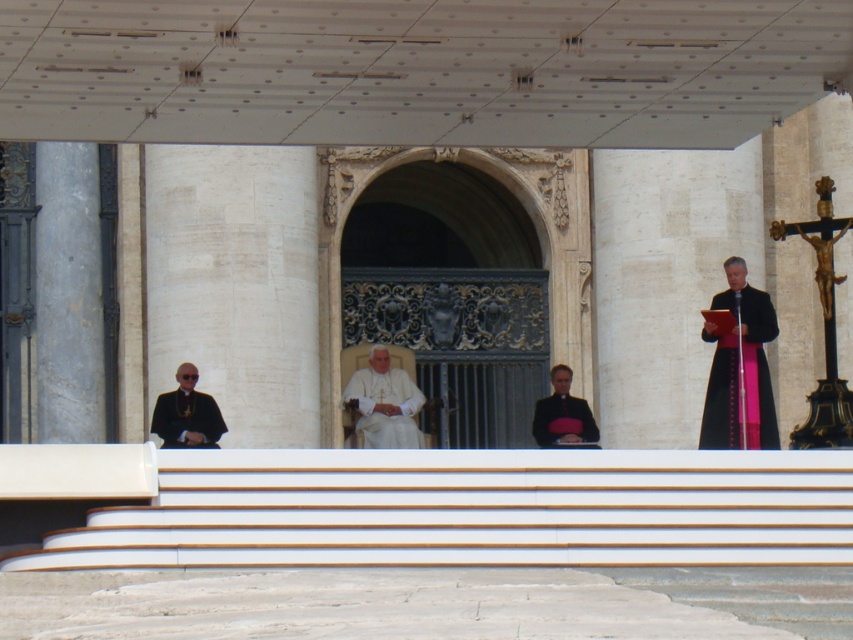
Is white matte/soft fabric at center above black satin robe at left?

Yes.

Looking at this image, which of these two, white matte/soft fabric at center or black satin robe at left, stands shorter?

black satin robe at left

Is point (387, 413) positioned in front of point (183, 387)?

No, it is behind (183, 387).

Image resolution: width=853 pixels, height=640 pixels. I want to click on white matte/soft fabric at center, so click(383, 403).

Is black velvet cassock at right smaller than black satin robe at left?

Indeed, black velvet cassock at right has a smaller size compared to black satin robe at left.

Does black velvet cassock at right appear on the left side of black satin robe at left?

In fact, black velvet cassock at right is to the right of black satin robe at left.

What do you see at coordinates (738, 368) in the screenshot?
I see `black velvet cassock at right` at bounding box center [738, 368].

The width and height of the screenshot is (853, 640). Find the location of `black velvet cassock at right`. black velvet cassock at right is located at coordinates (738, 368).

Which is in front, point (758, 416) or point (546, 445)?

Positioned in front is point (758, 416).

From the picture: Is black velvet cassock at right wider than black satin robe at center?

No.

Which is behind, point (727, 337) or point (550, 429)?

The point (550, 429) is more distant.

I want to click on black velvet cassock at right, so click(738, 368).